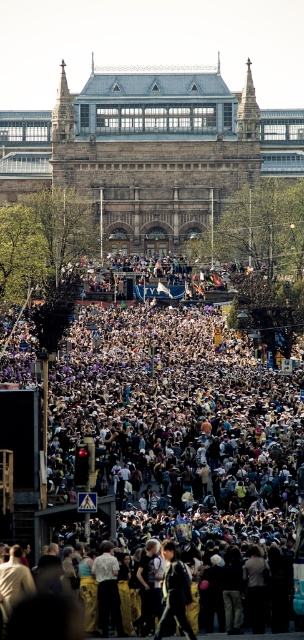
You are a photographer trying to capture a photo of the black matte jacket at center without the white cotton crowd at center blocking it. Can you move to the left side to get a clear shot?

The white cotton crowd at center is wider than the black matte jacket at center, so moving to the left side might not be sufficient to avoid the crowd blocking the jacket. You may need to adjust your position further or find an angle where the crowd is narrower.

You are a photographer trying to capture a clear shot of the historic building. You notice the white cotton crowd at center and the black matte jacket at center are blocking your view. Which object is taller and thus more obstructing your view?

The white cotton crowd at center is taller than the black matte jacket at center, making it the more obstructing object in your view.